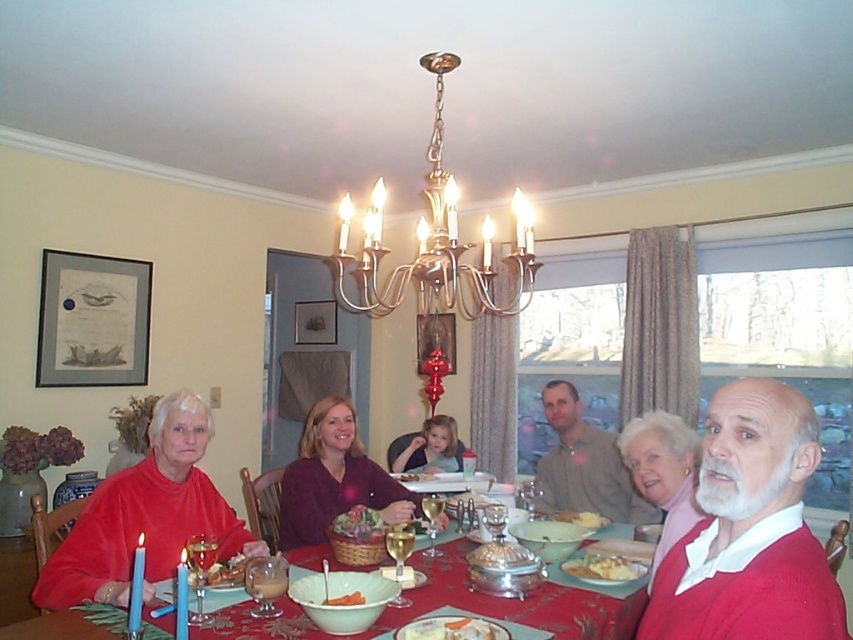
Question: From the image, what is the correct spatial relationship of pink wool sweater at lower right in relation to smooth wooden basket at center?

Choices:
 (A) below
 (B) above

Answer: (B)

Question: Does smooth wooden basket at center have a lesser width compared to yellowish matte bread at lower center?

Choices:
 (A) yes
 (B) no

Answer: (A)

Question: Estimate the real-world distances between objects in this image. Which object is closer to the pink wool sweater at lower right?

Choices:
 (A) yellowish matte bread at lower center
 (B) matte brown shirt at center

Answer: (A)

Question: Which point is farther to the camera?

Choices:
 (A) (689, 502)
 (B) (685, 589)
 (C) (555, 477)

Answer: (C)

Question: Which object is positioned farthest from the white creamy mashed potatoes at center?

Choices:
 (A) matte red sweater at center
 (B) smooth brown hair at center

Answer: (B)

Question: Is matte red sweater at center behind matte brown shirt at center?

Choices:
 (A) no
 (B) yes

Answer: (A)